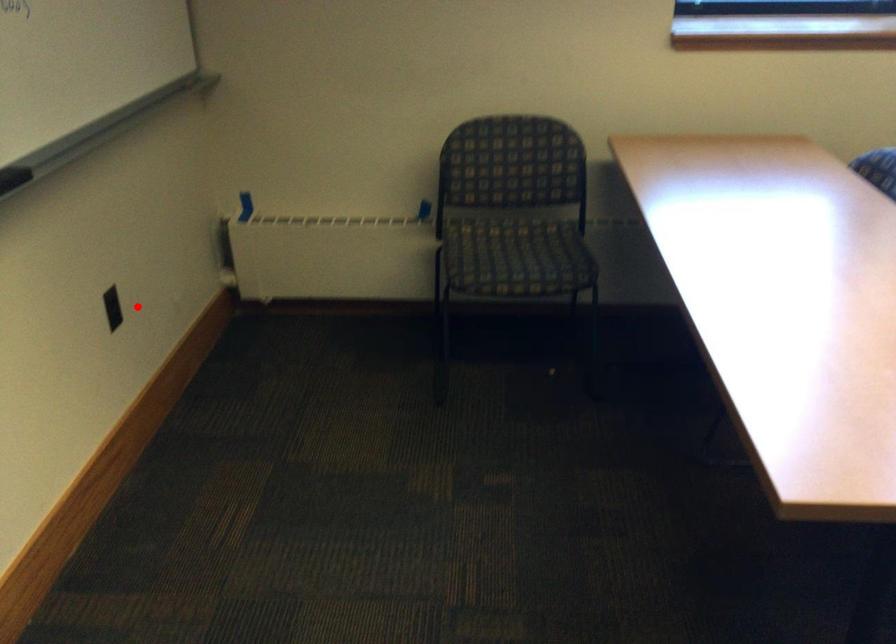
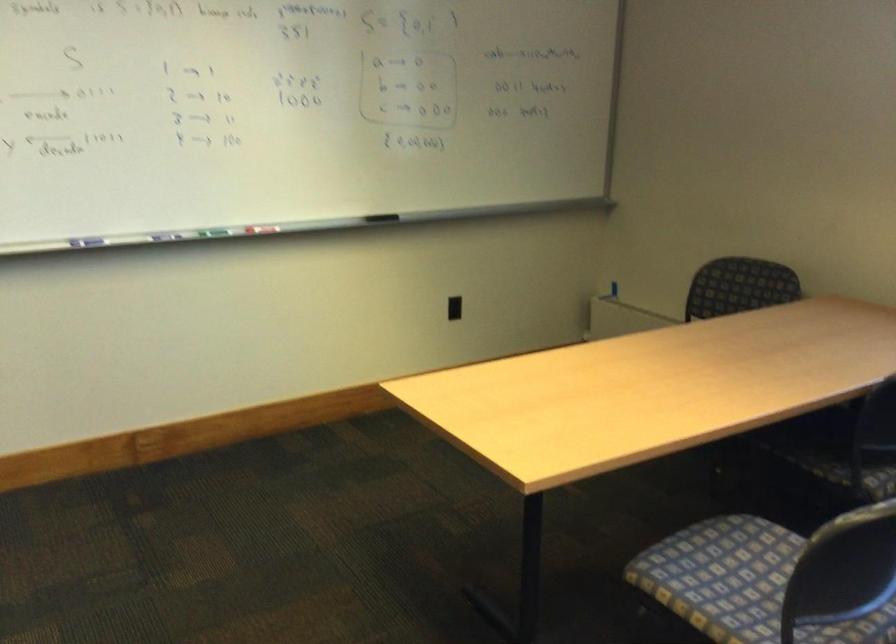
Question: I am providing you with two images of the same scene from different viewpoints. In image1, a red point is highlighted. Considering the same 3D point in image2, which of the following is correct?

Choices:
 (A) It is closer
 (B) It is farther

Answer: (B)